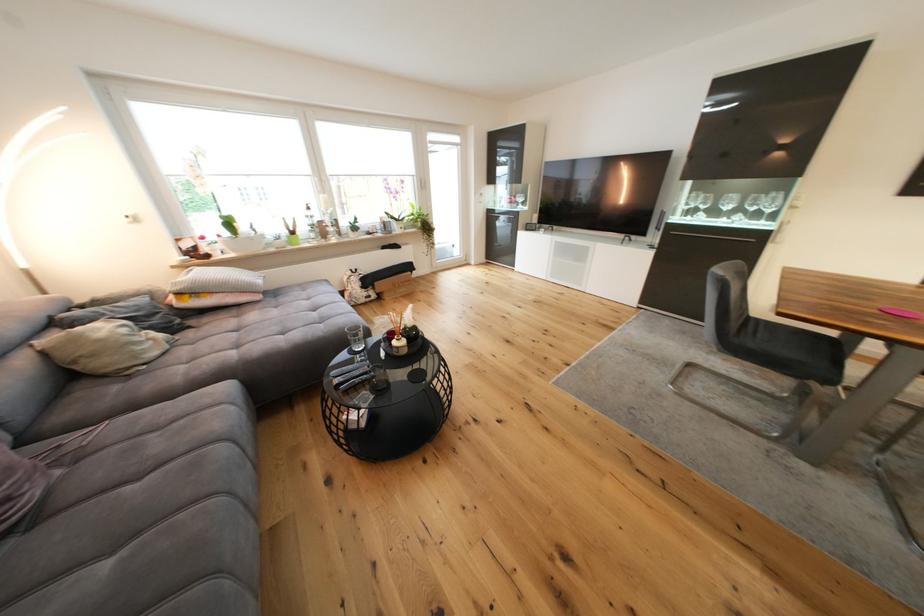
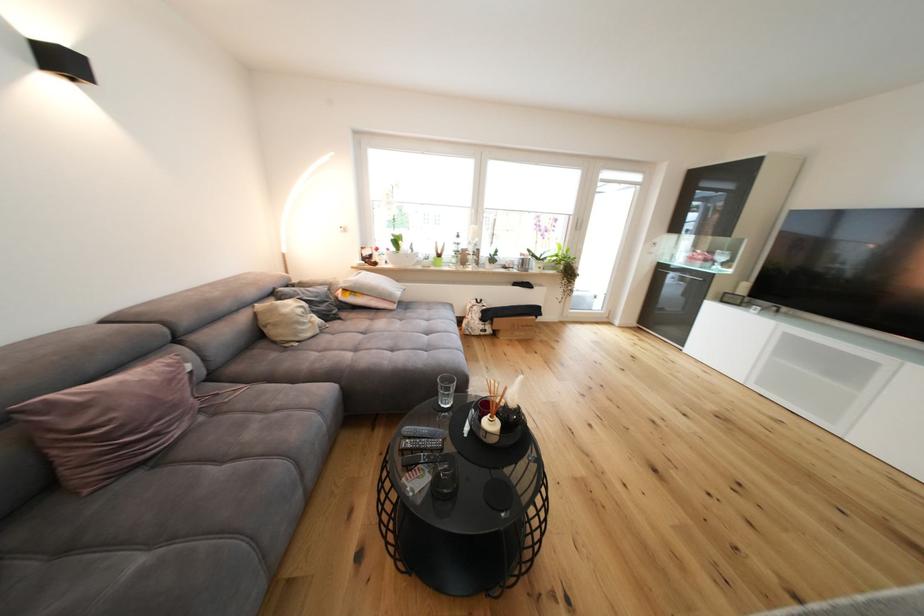
Question: The camera is either moving clockwise (left) or counter-clockwise (right) around the object. The first image is from the beginning of the video and the second image is from the end. Is the camera moving left or right when shooting the video?

Choices:
 (A) Left
 (B) Right

Answer: (B)